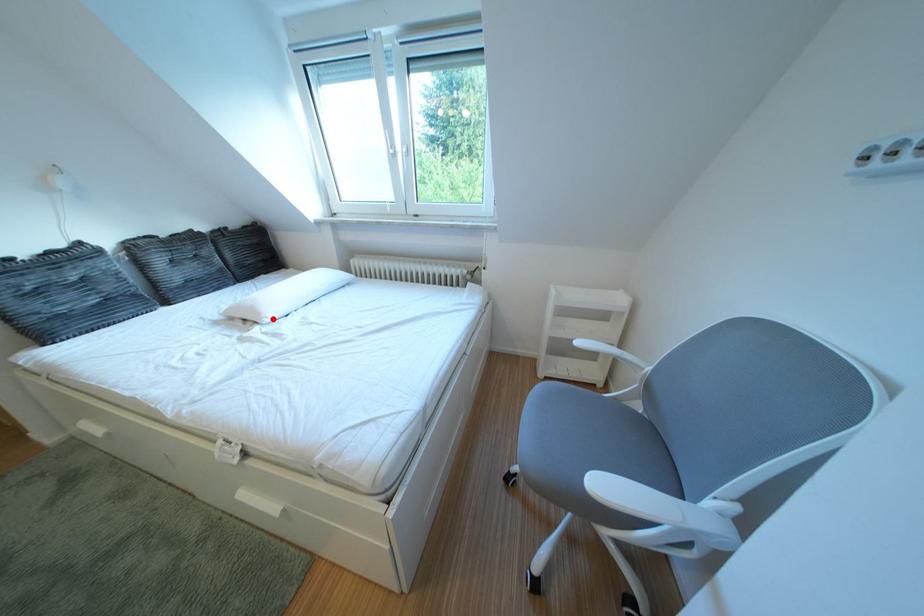
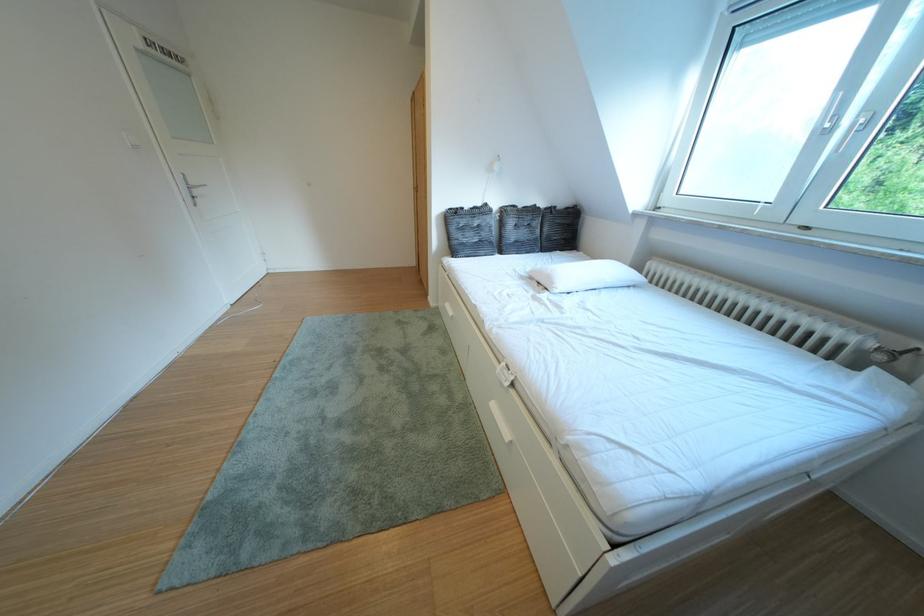
In the second image, find the point that corresponds to the highlighted location in the first image.

(565, 288)